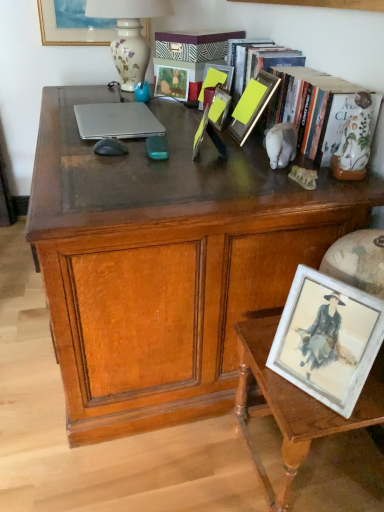
Identify the location of vacant space in wooden table at lower right (from a real-world perspective). (310, 470).